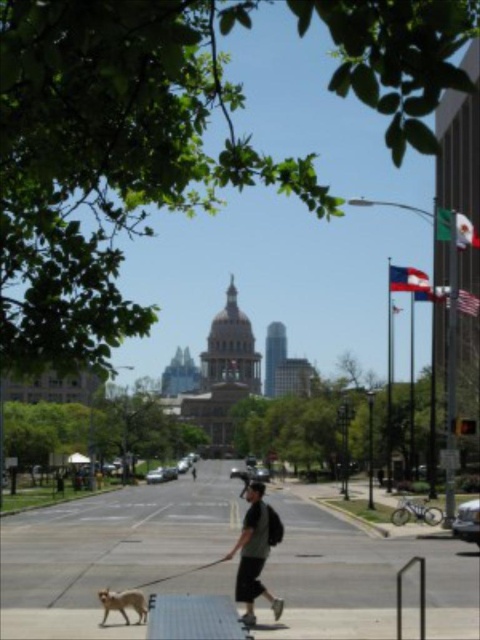
Who is more distant from viewer, (84, 520) or (243, 589)?

The point (84, 520) is behind.

You are a GUI agent. You are given a task and a screenshot of the screen. Output one action in this format:
    pyautogui.click(x=<x>, y=<y>)
    Task: Click on the smooth concrete sidewalk at center
    This screenshot has width=480, height=640.
    Given the screenshot: What is the action you would take?
    pyautogui.click(x=110, y=547)

Does smooth concrete sidewalk at center appear over wooden skateboard at lower center?

Actually, smooth concrete sidewalk at center is below wooden skateboard at lower center.

Who is taller, smooth concrete sidewalk at center or wooden skateboard at lower center?

With more height is smooth concrete sidewalk at center.

Is point (105, 632) closer to viewer compared to point (268, 630)?

Yes, point (105, 632) is closer to viewer.

Locate an element on the screen. This screenshot has height=640, width=480. smooth concrete sidewalk at center is located at coordinates (x=110, y=547).

Who is shorter, smooth concrete sidewalk at center or golden fur dog at lower left?

With less height is golden fur dog at lower left.

Locate an element on the screen. This screenshot has height=640, width=480. smooth concrete sidewalk at center is located at coordinates (110, 547).

Who is more distant from viewer, (165,548) or (120,595)?

Answer: The point (165,548) is more distant.

Image resolution: width=480 pixels, height=640 pixels. I want to click on smooth concrete sidewalk at center, so click(110, 547).